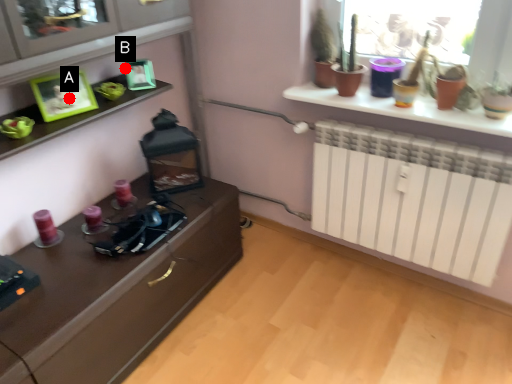
Question: Two points are circled on the image, labeled by A and B beside each circle. Which point is closer to the camera?

Choices:
 (A) A is closer
 (B) B is closer

Answer: (A)